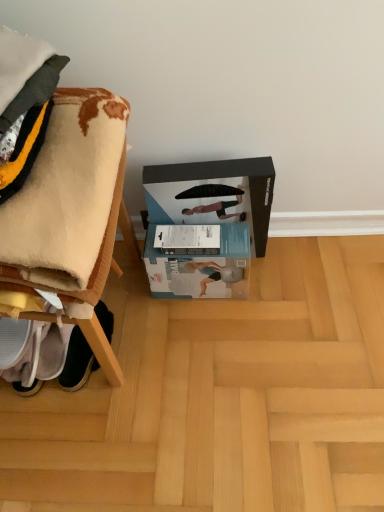
Question: In terms of size, does white fabric shoe at lower left appear bigger or smaller than white soft blanket at left?

Choices:
 (A) big
 (B) small

Answer: (B)

Question: Does point (82, 360) appear closer or farther from the camera than point (39, 189)?

Choices:
 (A) closer
 (B) farther

Answer: (B)

Question: Considering the real-world distances, which object is farthest from the white soft blanket at left?

Choices:
 (A) black matte cardboard box at center
 (B) white cardboard box at center
 (C) light brown wood at lower center
 (D) white fabric shoe at lower left

Answer: (C)

Question: Which is farther from the white cardboard box at center?

Choices:
 (A) black matte cardboard box at center
 (B) white fabric shoe at lower left
 (C) white soft blanket at left
 (D) light brown wood at lower center

Answer: (C)